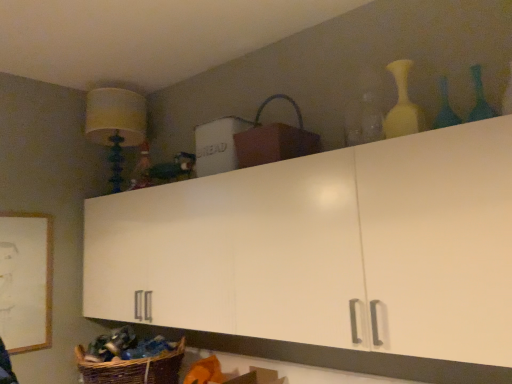
The height and width of the screenshot is (384, 512). In order to click on matte yellow fabric lampshade at upper left in this screenshot , I will do `click(116, 125)`.

This screenshot has height=384, width=512. What do you see at coordinates (479, 97) in the screenshot? I see `green glass bottle at upper right, the 1th bottle positioned from the right` at bounding box center [479, 97].

I want to click on woven brown basket at lower left, placed as the 2th basket when sorted from right to left, so (x=133, y=368).

Is matte yellow fabric lampshade at upper left positioned in front of white wooden picture frame at lower left?

No, it is behind white wooden picture frame at lower left.

Measure the distance between matte yellow fabric lampshade at upper left and white wooden picture frame at lower left.

matte yellow fabric lampshade at upper left and white wooden picture frame at lower left are 28.38 inches apart.

Which is more to the right, matte yellow fabric lampshade at upper left or white wooden picture frame at lower left?

Positioned to the right is matte yellow fabric lampshade at upper left.

From a real-world perspective, is matte yellow fabric lampshade at upper left physically below white wooden picture frame at lower left?

Actually, matte yellow fabric lampshade at upper left is physically above white wooden picture frame at lower left in the real world.

Does matte yellow fabric lampshade at upper left lie in front of green glass bottle at upper right, the 3th bottle positioned from the left?

No, it is behind green glass bottle at upper right, the 3th bottle positioned from the left.

Which of these two, matte yellow fabric lampshade at upper left or green glass bottle at upper right, the 3th bottle positioned from the left, is smaller?

With smaller size is green glass bottle at upper right, the 3th bottle positioned from the left.

Are matte yellow fabric lampshade at upper left and green glass bottle at upper right, the 3th bottle positioned from the left, located far from each other?

Indeed, matte yellow fabric lampshade at upper left is not near green glass bottle at upper right, the 3th bottle positioned from the left.

Considering the points (99, 116) and (482, 105), which point is in front, point (99, 116) or point (482, 105)?

Positioned in front is point (482, 105).

Is matte yellow vase at upper right, the 1th bottle from the left, facing towards white wooden picture frame at lower left?

No, matte yellow vase at upper right, the 1th bottle from the left, is not turned towards white wooden picture frame at lower left.

Is point (404, 90) closer or farther from the camera than point (35, 256)?

Point (404, 90) is closer to the camera than point (35, 256).

Is matte yellow vase at upper right, the 1th bottle from the left, far from white wooden picture frame at lower left?

matte yellow vase at upper right, the 1th bottle from the left, is positioned a significant distance from white wooden picture frame at lower left.

From a real-world perspective, is matte yellow vase at upper right, the 1th bottle from the left, below white wooden picture frame at lower left?

Incorrect, from a real-world perspective, matte yellow vase at upper right, the 1th bottle from the left, is higher than white wooden picture frame at lower left.

Looking at this image, who is shorter, white wooden picture frame at lower left or matte yellow vase at upper right, the third bottle when ordered from right to left?

matte yellow vase at upper right, the third bottle when ordered from right to left.

Could you tell me if white wooden picture frame at lower left is turned towards matte yellow vase at upper right, the 1th bottle from the left?

No, white wooden picture frame at lower left is not facing towards matte yellow vase at upper right, the 1th bottle from the left.

This screenshot has height=384, width=512. What are the coordinates of `picture frame behind the matte yellow vase at upper right, the third bottle when ordered from right to left` in the screenshot? It's located at (26, 281).

Based on their sizes in the image, would you say white wooden picture frame at lower left is bigger or smaller than matte yellow vase at upper right, the third bottle when ordered from right to left?

Considering their sizes, white wooden picture frame at lower left takes up more space than matte yellow vase at upper right, the third bottle when ordered from right to left.

Which of these two, matte yellow vase at upper right, the 1th bottle from the left, or blue glass bottle at upper right, acting as the 2th bottle starting from the right, is bigger?

matte yellow vase at upper right, the 1th bottle from the left, is bigger.

Which is behind, point (418, 118) or point (447, 118)?

The point (418, 118) is more distant.

Based on the photo, would you say matte yellow vase at upper right, the 1th bottle from the left, contains blue glass bottle at upper right, acting as the 2th bottle starting from the right?

No, blue glass bottle at upper right, acting as the 2th bottle starting from the right, is not a part of matte yellow vase at upper right, the 1th bottle from the left.

Looking at their sizes, would you say matte yellow vase at upper right, the third bottle when ordered from right to left, is wider or thinner than blue glass bottle at upper right, acting as the 2th bottle starting from the right?

matte yellow vase at upper right, the third bottle when ordered from right to left, is wider than blue glass bottle at upper right, acting as the 2th bottle starting from the right.

Could you tell me if brown woven basket at upper center, which ranks as the first basket in right-to-left order, is turned towards white wooden picture frame at lower left?

No.

Is brown woven basket at upper center, which is the second basket from left to right, directly adjacent to white wooden picture frame at lower left?

No, brown woven basket at upper center, which is the second basket from left to right, is not in contact with white wooden picture frame at lower left.

Who is more distant, brown woven basket at upper center, which is the second basket from left to right, or white wooden picture frame at lower left?

white wooden picture frame at lower left.

From the image's perspective, is brown woven basket at upper center, acting as the 2th basket starting from the bottom, above or below white wooden picture frame at lower left?

brown woven basket at upper center, acting as the 2th basket starting from the bottom, is above white wooden picture frame at lower left.

Which is correct: blue glass bottle at upper right, marked as the 2th bottle in a left-to-right arrangement, is inside green glass bottle at upper right, the 1th bottle positioned from the right, or outside of it?

The correct answer is: outside.

Measure the distance from blue glass bottle at upper right, marked as the 2th bottle in a left-to-right arrangement, to green glass bottle at upper right, the 3th bottle positioned from the left.

blue glass bottle at upper right, marked as the 2th bottle in a left-to-right arrangement, is 3.87 inches from green glass bottle at upper right, the 3th bottle positioned from the left.

Does point (450, 121) come behind point (489, 108)?

Yes, it is.

Does blue glass bottle at upper right, marked as the 2th bottle in a left-to-right arrangement, have a lesser width compared to green glass bottle at upper right, the 3th bottle positioned from the left?

No.

The image size is (512, 384). What are the coordinates of `picture frame that is on the left side of matte yellow fabric lampshade at upper left` in the screenshot? It's located at tap(26, 281).

From the image's perspective, starting from the matte yellow fabric lampshade at upper left, which bottle is the 2nd one above? Please provide its 2D coordinates.

[(479, 97)]

Based on the photo, from the image, which object appears to be nearer to woven brown basket at lower left, placed as the 2th basket when sorted from right to left, green glass bottle at upper right, the 3th bottle positioned from the left, or matte yellow vase at upper right, the third bottle when ordered from right to left?

matte yellow vase at upper right, the third bottle when ordered from right to left, is closer to woven brown basket at lower left, placed as the 2th basket when sorted from right to left.

Based on their spatial positions, is brown woven basket at upper center, acting as the 2th basket starting from the bottom, or matte yellow fabric lampshade at upper left further from blue glass bottle at upper right, acting as the 2th bottle starting from the right?

Based on the image, matte yellow fabric lampshade at upper left appears to be further to blue glass bottle at upper right, acting as the 2th bottle starting from the right.

From the picture: Based on their spatial positions, is green glass bottle at upper right, the 1th bottle positioned from the right, or blue glass bottle at upper right, marked as the 2th bottle in a left-to-right arrangement, closer to matte yellow vase at upper right, the 1th bottle from the left?

blue glass bottle at upper right, marked as the 2th bottle in a left-to-right arrangement, lies closer to matte yellow vase at upper right, the 1th bottle from the left, than the other object.

Looking at the image, which one is located closer to matte yellow fabric lampshade at upper left, brown woven basket at upper center, acting as the 2th basket starting from the bottom, or woven brown basket at lower left, placed as the 2th basket when sorted from right to left?

brown woven basket at upper center, acting as the 2th basket starting from the bottom.

When comparing their distances from matte yellow fabric lampshade at upper left, does woven brown basket at lower left, the 1th basket positioned from the bottom, or blue glass bottle at upper right, marked as the 2th bottle in a left-to-right arrangement, seem further?

Based on the image, blue glass bottle at upper right, marked as the 2th bottle in a left-to-right arrangement, appears to be further to matte yellow fabric lampshade at upper left.

Considering their positions, is matte yellow fabric lampshade at upper left positioned closer to white wooden picture frame at lower left than woven brown basket at lower left, positioned as the 1th basket in left-to-right order?

The object closer to white wooden picture frame at lower left is woven brown basket at lower left, positioned as the 1th basket in left-to-right order.

Considering their positions, is green glass bottle at upper right, the 3th bottle positioned from the left, positioned closer to blue glass bottle at upper right, marked as the 2th bottle in a left-to-right arrangement, than brown woven basket at upper center, which is the second basket from left to right?

The object closer to blue glass bottle at upper right, marked as the 2th bottle in a left-to-right arrangement, is green glass bottle at upper right, the 3th bottle positioned from the left.

Based on their spatial positions, is blue glass bottle at upper right, acting as the 2th bottle starting from the right, or green glass bottle at upper right, the 3th bottle positioned from the left, closer to brown woven basket at upper center, acting as the 2th basket starting from the bottom?

blue glass bottle at upper right, acting as the 2th bottle starting from the right, lies closer to brown woven basket at upper center, acting as the 2th basket starting from the bottom, than the other object.

You are a GUI agent. You are given a task and a screenshot of the screen. Output one action in this format:
    pyautogui.click(x=<x>, y=<y>)
    Task: Click on the lamp between white wooden picture frame at lower left and matte yellow vase at upper right, the 1th bottle from the left, in the horizontal direction
    Image resolution: width=512 pixels, height=384 pixels.
    Given the screenshot: What is the action you would take?
    pyautogui.click(x=116, y=125)

The width and height of the screenshot is (512, 384). Find the location of `bottle between matte yellow vase at upper right, the 1th bottle from the left, and green glass bottle at upper right, the 1th bottle positioned from the right, in the horizontal direction`. bottle between matte yellow vase at upper right, the 1th bottle from the left, and green glass bottle at upper right, the 1th bottle positioned from the right, in the horizontal direction is located at coordinates (445, 108).

Locate an element on the screen. The width and height of the screenshot is (512, 384). bottle between white wooden picture frame at lower left and blue glass bottle at upper right, acting as the 2th bottle starting from the right, from left to right is located at coordinates (402, 105).

Where is `basket that lies between blue glass bottle at upper right, acting as the 2th bottle starting from the right, and woven brown basket at lower left, the second basket in the top-to-bottom sequence, from top to bottom`? basket that lies between blue glass bottle at upper right, acting as the 2th bottle starting from the right, and woven brown basket at lower left, the second basket in the top-to-bottom sequence, from top to bottom is located at coordinates (274, 139).